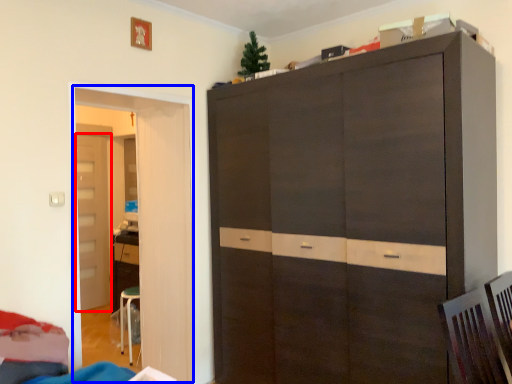
Question: Which object appears closest to the camera in this image, door (highlighted by a red box) or door (highlighted by a blue box)?

Choices:
 (A) door
 (B) door

Answer: (B)